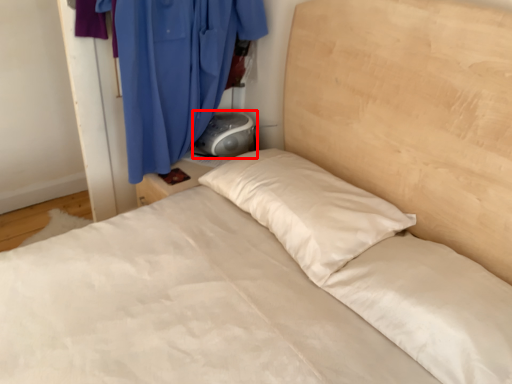
Question: Observing the image, what is the correct spatial positioning of gray (annotated by the red box) in reference to curtain?

Choices:
 (A) right
 (B) left

Answer: (A)